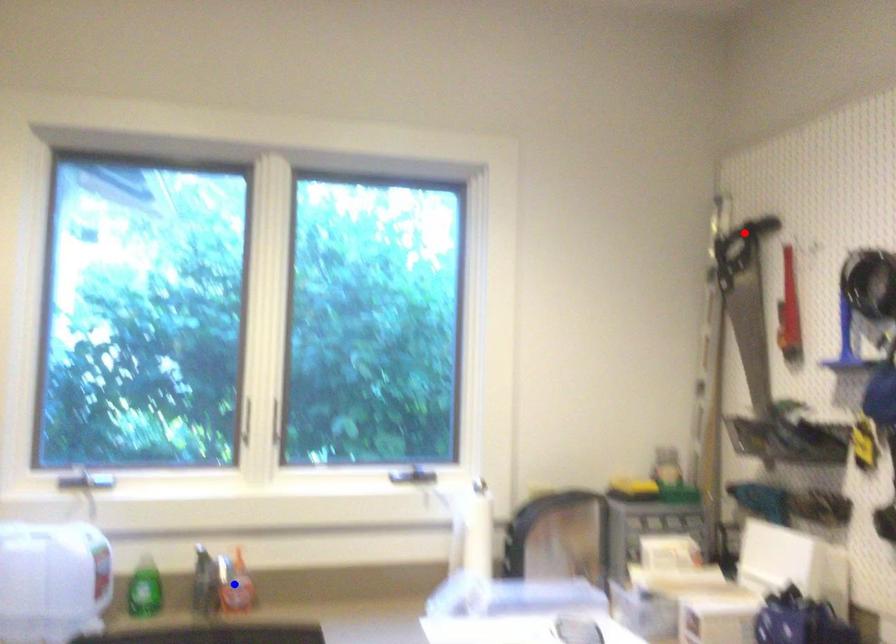
Question: Two points are marked on the image. Which point is closer to the camera?

Choices:
 (A) Blue point is closer.
 (B) Red point is closer.

Answer: (A)